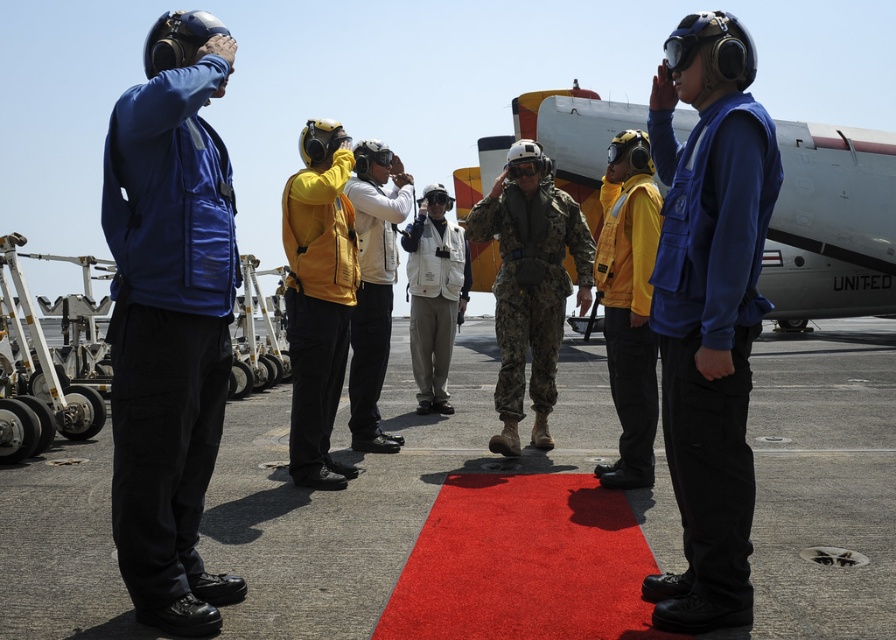
Between white matte helmet at center and white fabric jacket at center, which one appears on the left side from the viewer's perspective?

Positioned to the left is white matte helmet at center.

Identify the location of white matte helmet at center. (373, 285).

Which is above, blue fabric helmet at left or white matte helmet at center?

white matte helmet at center is higher up.

Which is in front, point (200, 19) or point (360, 195)?

Positioned in front is point (200, 19).

The height and width of the screenshot is (640, 896). I want to click on blue fabric helmet at left, so click(x=169, y=317).

Find the location of a particular element. blue fabric helmet at left is located at coordinates (169, 317).

Measure the distance between white matte airplane at center and camera.

white matte airplane at center and camera are 15.02 meters apart from each other.

Does white matte airplane at center lie behind camouflage fabric uniform at center?

Yes, it is behind camouflage fabric uniform at center.

Measure the distance between point [871,273] and camera.

A distance of 59.18 feet exists between point [871,273] and camera.

Where is `white matte airplane at center`? white matte airplane at center is located at coordinates (831, 225).